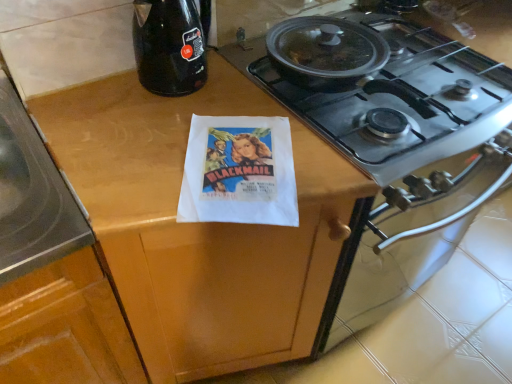
Find the location of a particular element. This screenshot has width=512, height=384. free spot above white paper flyer at center (from a real-world perspective) is located at coordinates (240, 153).